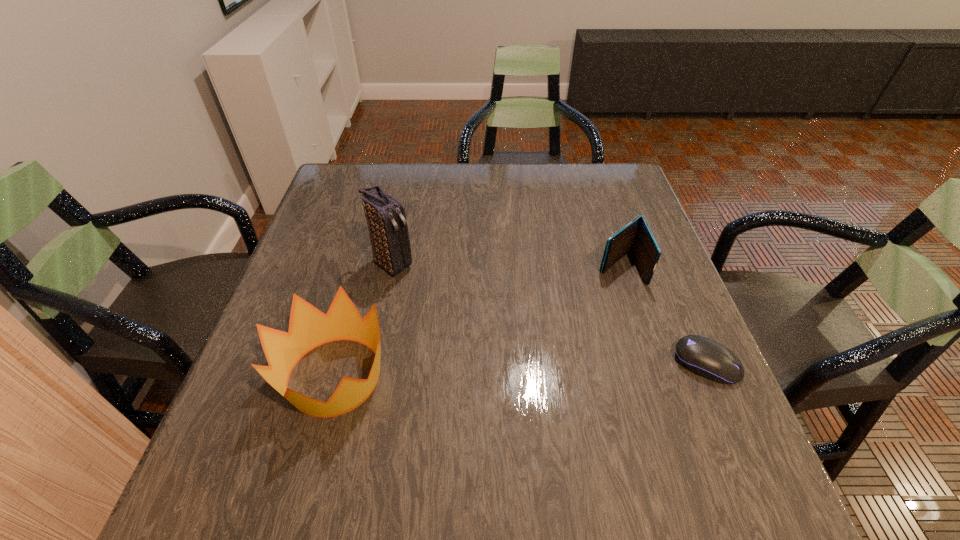
Locate an element on the screen. vacant space on the desktop that is between the crown and the shortest object and is positioned with the zip open on the clutch bag is located at coordinates (529, 369).

At what (x,y) coordinates should I click in order to perform the action: click on vacant space on the desktop that is between the crown and the computer mouse and is positioned on the exterior surface of the wallet. Please return your answer as a coordinate pair (x, y). Looking at the image, I should click on (482, 371).